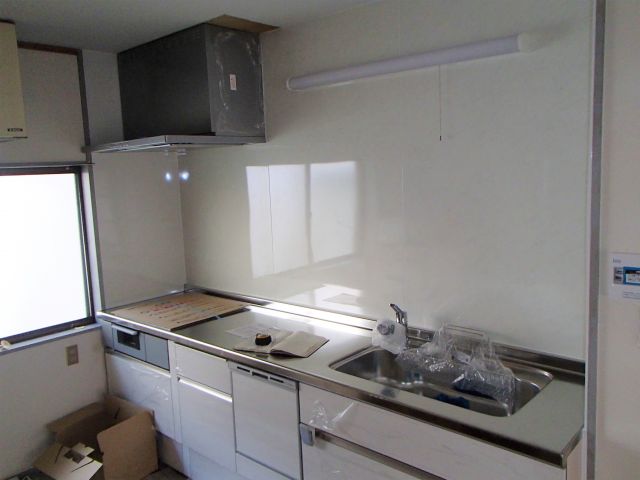
The width and height of the screenshot is (640, 480). In order to click on window in this screenshot , I will do `click(43, 246)`.